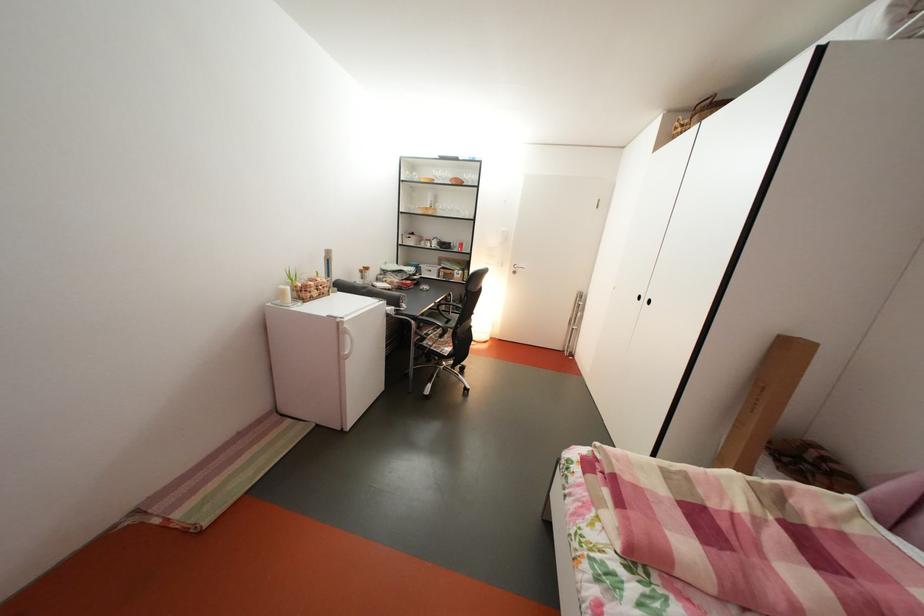
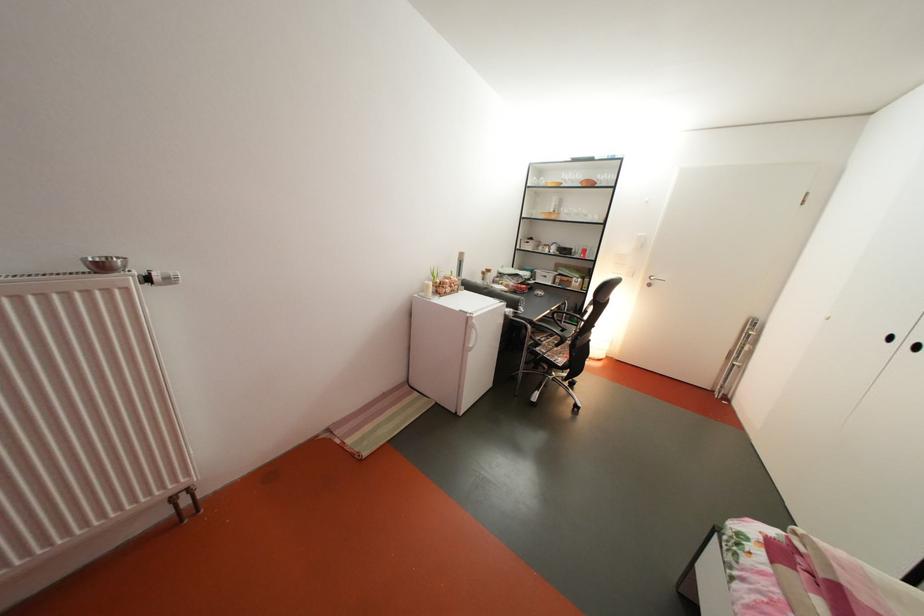
The point at (468, 252) is marked in the first image. Where is the corresponding point in the second image?

(591, 257)